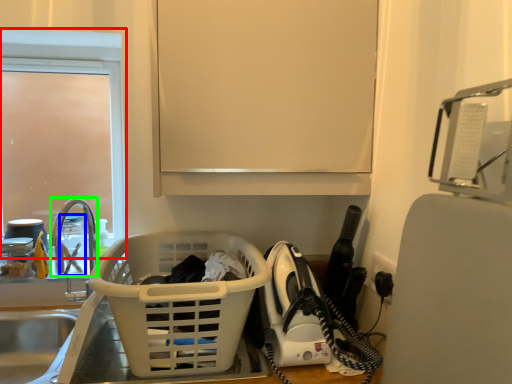
Question: Estimate the real-world distances between objects in this image. Which object is closer to glass door (highlighted by a red box), bottle (highlighted by a blue box) or faucet (highlighted by a green box)?

Choices:
 (A) bottle
 (B) faucet

Answer: (B)